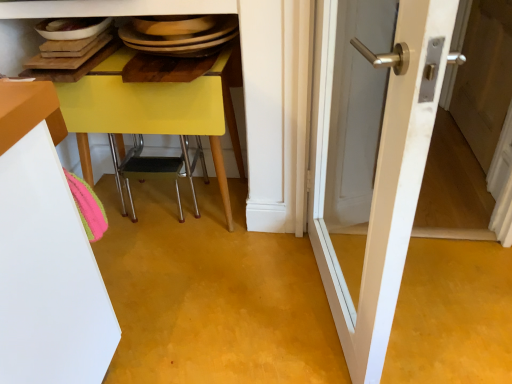
Question: Could you tell me if white glossy door at center is facing yellow plastic chair at lower center?

Choices:
 (A) no
 (B) yes

Answer: (A)

Question: From the image's perspective, would you say white glossy door at center is shown under yellow plastic chair at lower center?

Choices:
 (A) yes
 (B) no

Answer: (A)

Question: Considering the relative sizes of white glossy door at center and yellow plastic chair at lower center in the image provided, is white glossy door at center shorter than yellow plastic chair at lower center?

Choices:
 (A) no
 (B) yes

Answer: (A)

Question: Is white glossy door at center far from yellow plastic chair at lower center?

Choices:
 (A) yes
 (B) no

Answer: (B)

Question: From a real-world perspective, is white glossy door at center beneath yellow plastic chair at lower center?

Choices:
 (A) no
 (B) yes

Answer: (A)

Question: Is white glossy door at center wider or thinner than yellow plastic chair at lower center?

Choices:
 (A) wide
 (B) thin

Answer: (B)

Question: From a real-world perspective, is white glossy door at center above or below yellow plastic chair at lower center?

Choices:
 (A) above
 (B) below

Answer: (A)

Question: Is white glossy door at center taller or shorter than yellow plastic chair at lower center?

Choices:
 (A) short
 (B) tall

Answer: (B)

Question: In terms of size, does white glossy door at center appear bigger or smaller than yellow plastic chair at lower center?

Choices:
 (A) big
 (B) small

Answer: (B)

Question: Considering the positions of point (351, 377) and point (478, 132), is point (351, 377) closer or farther from the camera than point (478, 132)?

Choices:
 (A) farther
 (B) closer

Answer: (B)

Question: From their relative heights in the image, would you say white glossy door at center is taller or shorter than white wood screen door at right?

Choices:
 (A) short
 (B) tall

Answer: (B)

Question: Looking at the image, does white glossy door at center seem bigger or smaller compared to white wood screen door at right?

Choices:
 (A) big
 (B) small

Answer: (A)

Question: Is white glossy door at center wider or thinner than white wood screen door at right?

Choices:
 (A) thin
 (B) wide

Answer: (B)

Question: Choose the correct answer: Is white wood screen door at right inside white glossy door at center or outside it?

Choices:
 (A) outside
 (B) inside

Answer: (A)

Question: From the image's perspective, relative to white glossy door at center, is white wood screen door at right above or below?

Choices:
 (A) above
 (B) below

Answer: (A)